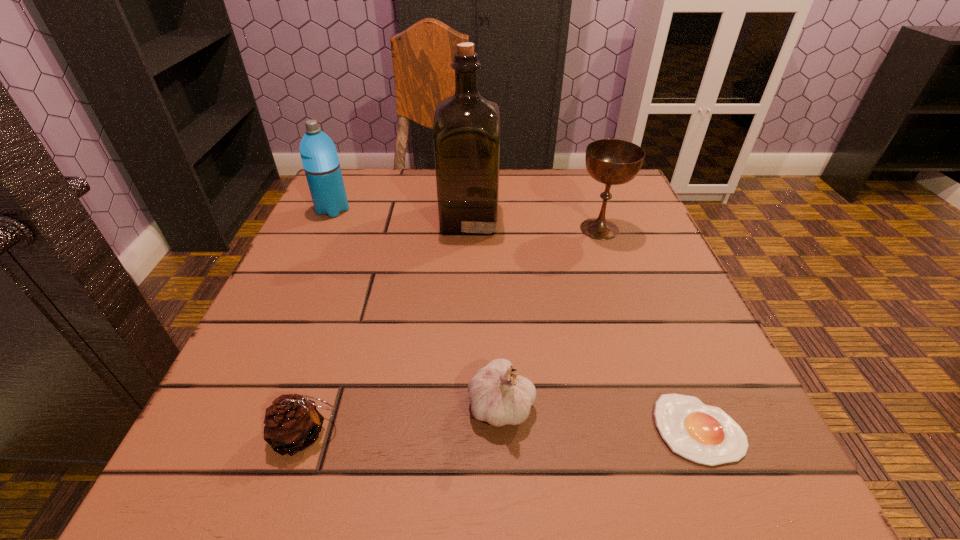
In the image, there is a desktop. At what (x,y) coordinates should I click in order to perform the action: click on vacant space at the right edge. Please return your answer as a coordinate pair (x, y). This screenshot has width=960, height=540. Looking at the image, I should click on (633, 281).

You are a GUI agent. You are given a task and a screenshot of the screen. Output one action in this format:
    pyautogui.click(x=<x>, y=<y>)
    Task: Click on the free space at the far left corner of the desktop
    
    Given the screenshot: What is the action you would take?
    pyautogui.click(x=378, y=168)

This screenshot has width=960, height=540. I want to click on vacant space at the far right corner, so click(x=571, y=183).

Locate an element on the screen. The height and width of the screenshot is (540, 960). vacant point located between the third shortest object and the egg yolk is located at coordinates (600, 417).

Where is `vacant space in between the shortest object and the garlic`? The width and height of the screenshot is (960, 540). vacant space in between the shortest object and the garlic is located at coordinates (600, 417).

Image resolution: width=960 pixels, height=540 pixels. I want to click on free space between the shortest object and the fifth tallest object, so click(502, 431).

Find the location of `vacant region between the chalice and the tallest object`. vacant region between the chalice and the tallest object is located at coordinates (534, 224).

At what (x,y) coordinates should I click in order to perform the action: click on free space between the shortest object and the second shortest object. Please return your answer as a coordinate pair (x, y). Looking at the image, I should click on (502, 431).

The image size is (960, 540). In order to click on free area in between the fifth tallest object and the chalice in this screenshot , I will do `click(452, 332)`.

Locate an element on the screen. Image resolution: width=960 pixels, height=540 pixels. free area in between the chalice and the egg yolk is located at coordinates (649, 329).